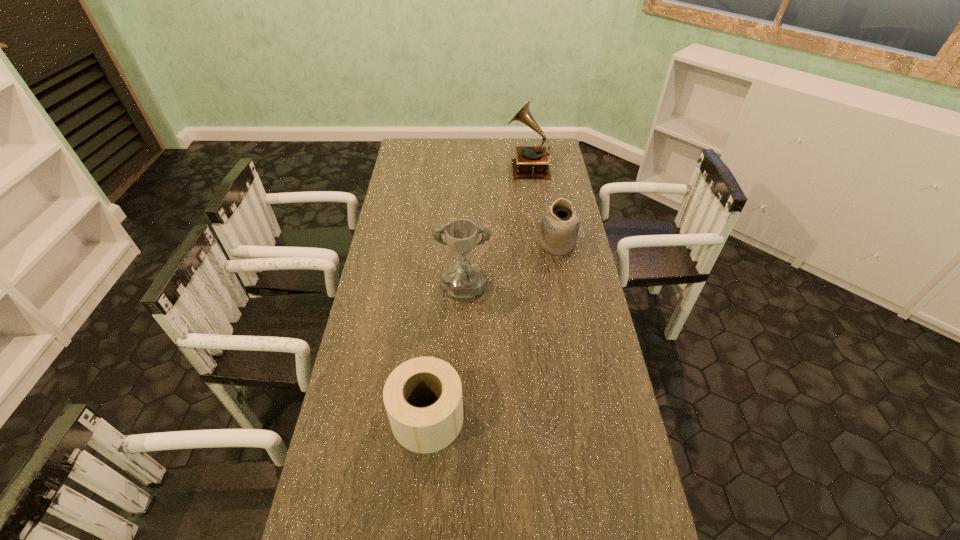
I want to click on free space located on the back of the pottery, so click(x=553, y=223).

This screenshot has height=540, width=960. Identify the location of vacant region located on the back of the nearest object. click(x=439, y=289).

In order to click on object positioned at the far edge in this screenshot , I will do `click(531, 162)`.

Identify the location of object located at the left edge. (429, 429).

This screenshot has height=540, width=960. What are the coordinates of `record player located at the right edge` in the screenshot? It's located at (531, 162).

Identify the location of pottery that is at the right edge. (559, 229).

You are a GUI agent. You are given a task and a screenshot of the screen. Output one action in this format:
    pyautogui.click(x=<x>, y=<y>)
    Task: Click on the object at the far right corner
    Image resolution: width=960 pixels, height=540 pixels.
    Given the screenshot: What is the action you would take?
    point(531,162)

What are the coordinates of `vacant space at the far edge` in the screenshot? It's located at (478, 157).

This screenshot has width=960, height=540. In the image, there is a desktop. Find the location of `vacant space at the left edge`. vacant space at the left edge is located at coordinates (412, 183).

Image resolution: width=960 pixels, height=540 pixels. In order to click on free space at the right edge in this screenshot , I will do `click(548, 275)`.